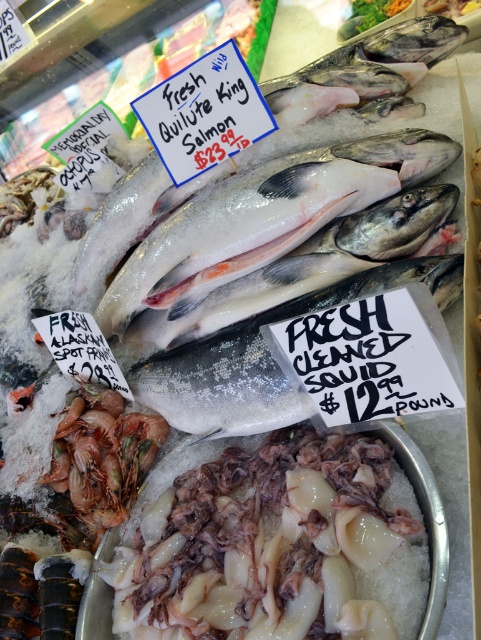
Locate an element on the screen. The width and height of the screenshot is (481, 640). translucent white squid at center is located at coordinates pyautogui.click(x=266, y=545).

Is translucent white squid at center further to the viewer compared to white glossy salmon at center?

No, it is not.

You are a GUI agent. You are given a task and a screenshot of the screen. Output one action in this format:
    pyautogui.click(x=<x>, y=<y>)
    Task: Click on the translucent white squid at center
    This screenshot has width=481, height=640.
    Given the screenshot: What is the action you would take?
    pyautogui.click(x=266, y=545)

Does white glossy salmon at center have a greater height compared to shiny silver salmon at center?

Indeed, white glossy salmon at center has a greater height compared to shiny silver salmon at center.

Is white glossy salmon at center to the left of shiny silver salmon at center from the viewer's perspective?

In fact, white glossy salmon at center is to the right of shiny silver salmon at center.

Who is more forward, (x=305, y=408) or (x=392, y=196)?

Point (x=305, y=408)

This screenshot has height=640, width=481. I want to click on white glossy salmon at center, so click(x=265, y=356).

Can you confirm if translucent white squid at center is bigger than shiny silver salmon at center?

No, translucent white squid at center is not bigger than shiny silver salmon at center.

Describe the element at coordinates (266, 545) in the screenshot. The width and height of the screenshot is (481, 640). I see `translucent white squid at center` at that location.

Who is more distant from viewer, (x=361, y=536) or (x=363, y=260)?

The point (x=363, y=260) is behind.

Identify the location of translucent white squid at center. Image resolution: width=481 pixels, height=640 pixels. (266, 545).